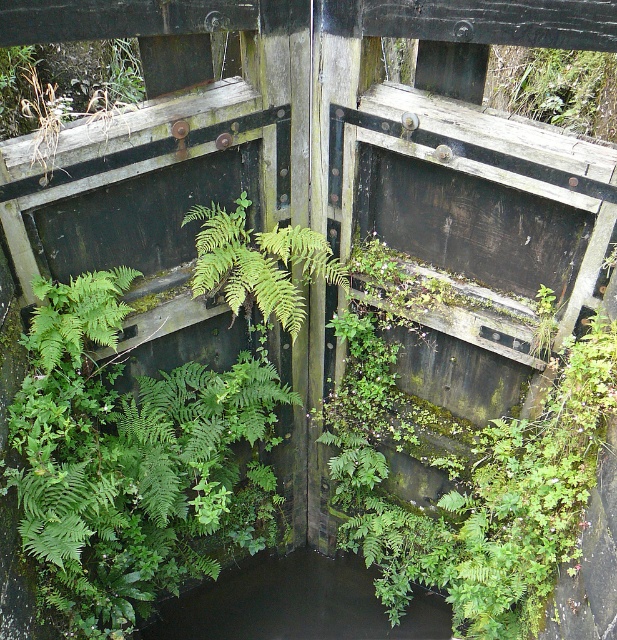
You are standing in front of the wooden sluice gate described in the scene. There is a dark liquid water at center marked by coordinates point [294,604]. If you want to avoid stepping into the water, which direction should you move relative to the gate?

The dark liquid water is located at point [294,604], which is at the center of the gate. To avoid stepping into the water, you should move either to the left or right of the gate away from the center point.

You are a gardener assessing the growth of plants on a wooden sluice gate. You notice the green leafy plant at upper center and the green leafy fern at left. Which plant is taller?

The green leafy plant at upper center is taller than the green leafy fern at left.